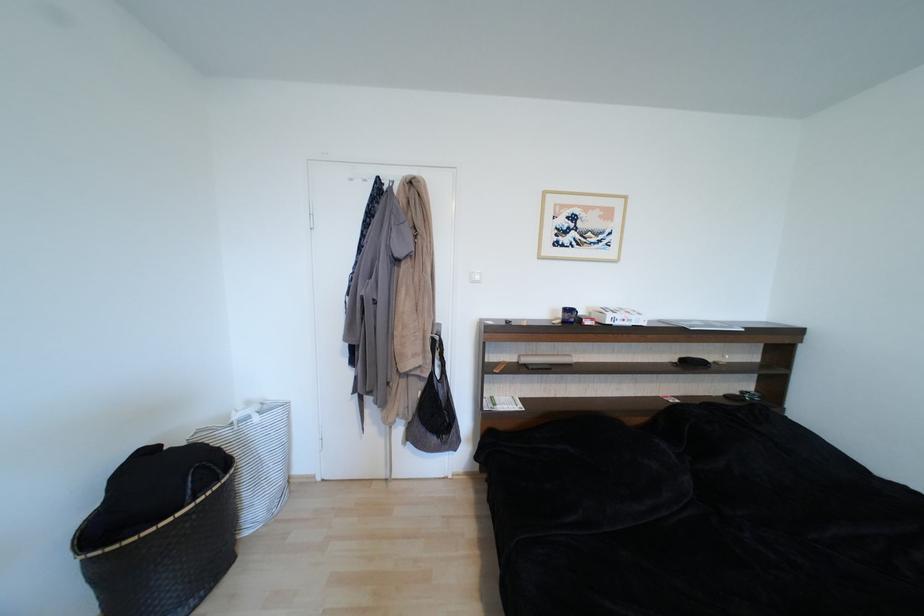
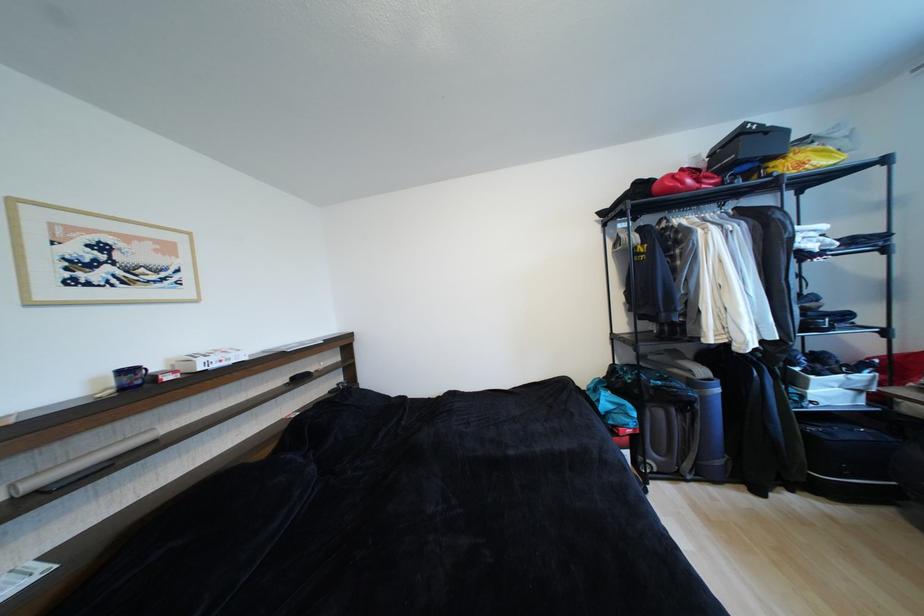
In the second image, find the point that corresponds to point 575,312 in the first image.

(134, 373)